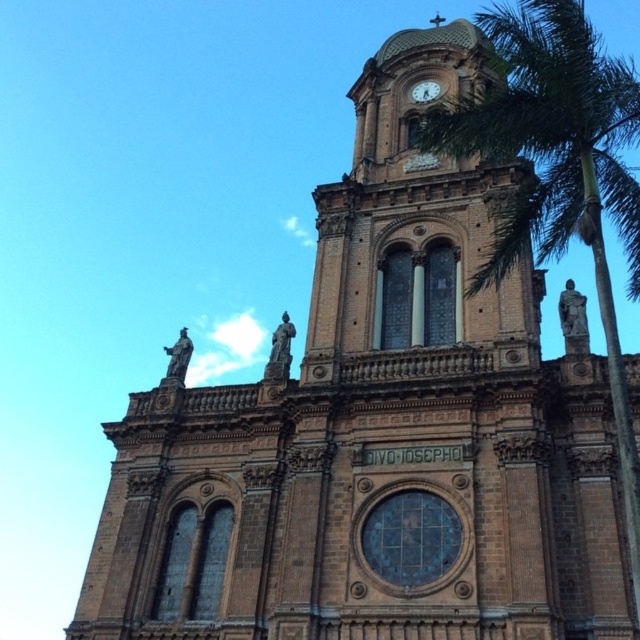
Question: Which point is closer to the camera taking this photo?

Choices:
 (A) (566, 131)
 (B) (435, 93)

Answer: (A)

Question: Is green leafy palm tree at right above gold metallic clock at upper center?

Choices:
 (A) yes
 (B) no

Answer: (A)

Question: Observing the image, what is the correct spatial positioning of green leafy palm tree at right in reference to gold metallic clock at upper center?

Choices:
 (A) right
 (B) left

Answer: (A)

Question: Does green leafy palm tree at right come behind gold metallic clock at upper center?

Choices:
 (A) yes
 (B) no

Answer: (B)

Question: Which object is closer to the camera taking this photo?

Choices:
 (A) green leafy palm tree at right
 (B) gold metallic clock at upper center

Answer: (A)